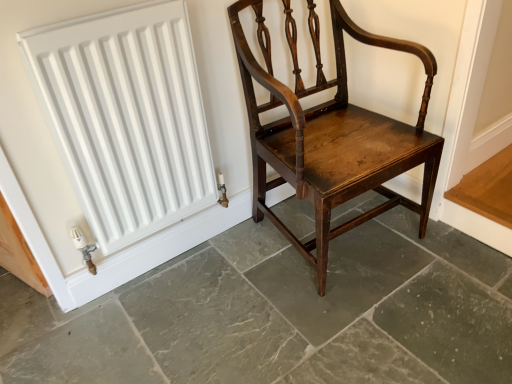
Question: Should I look upward or downward to see white matte radiator at upper left?

Choices:
 (A) up
 (B) down

Answer: (A)

Question: Does dark brown wood chair at center have a lesser height compared to shiny dark wood chair at center?

Choices:
 (A) no
 (B) yes

Answer: (B)

Question: From the image's perspective, is dark brown wood chair at center above shiny dark wood chair at center?

Choices:
 (A) no
 (B) yes

Answer: (A)

Question: Considering the relative sizes of dark brown wood chair at center and shiny dark wood chair at center in the image provided, is dark brown wood chair at center smaller than shiny dark wood chair at center?

Choices:
 (A) yes
 (B) no

Answer: (A)

Question: Is dark brown wood chair at center turned away from shiny dark wood chair at center?

Choices:
 (A) yes
 (B) no

Answer: (A)

Question: Is dark brown wood chair at center not inside shiny dark wood chair at center?

Choices:
 (A) no
 (B) yes

Answer: (B)

Question: Does dark brown wood chair at center come behind shiny dark wood chair at center?

Choices:
 (A) yes
 (B) no

Answer: (B)

Question: Is white matte radiator at upper left taller than shiny dark wood chair at center?

Choices:
 (A) no
 (B) yes

Answer: (A)

Question: Is white matte radiator at upper left far from shiny dark wood chair at center?

Choices:
 (A) yes
 (B) no

Answer: (B)

Question: Is white matte radiator at upper left facing away from shiny dark wood chair at center?

Choices:
 (A) no
 (B) yes

Answer: (A)

Question: Considering the relative sizes of white matte radiator at upper left and shiny dark wood chair at center in the image provided, is white matte radiator at upper left wider than shiny dark wood chair at center?

Choices:
 (A) no
 (B) yes

Answer: (A)

Question: Is the position of white matte radiator at upper left less distant than that of shiny dark wood chair at center?

Choices:
 (A) no
 (B) yes

Answer: (A)

Question: Is white matte radiator at upper left shorter than shiny dark wood chair at center?

Choices:
 (A) no
 (B) yes

Answer: (B)

Question: Can you confirm if white matte radiator at upper left is smaller than dark brown wood chair at center?

Choices:
 (A) no
 (B) yes

Answer: (B)